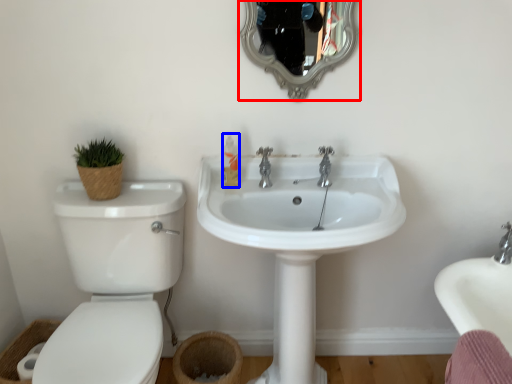
Question: Which object appears closest to the camera in this image, mirror (highlighted by a red box) or toiletry (highlighted by a blue box)?

Choices:
 (A) mirror
 (B) toiletry

Answer: (A)